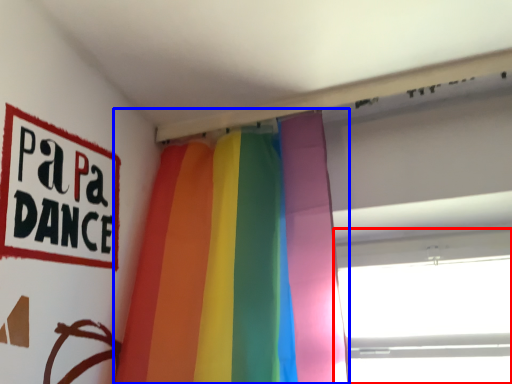
Question: Which object is further to the camera taking this photo, window (highlighted by a red box) or curtain (highlighted by a blue box)?

Choices:
 (A) window
 (B) curtain

Answer: (A)